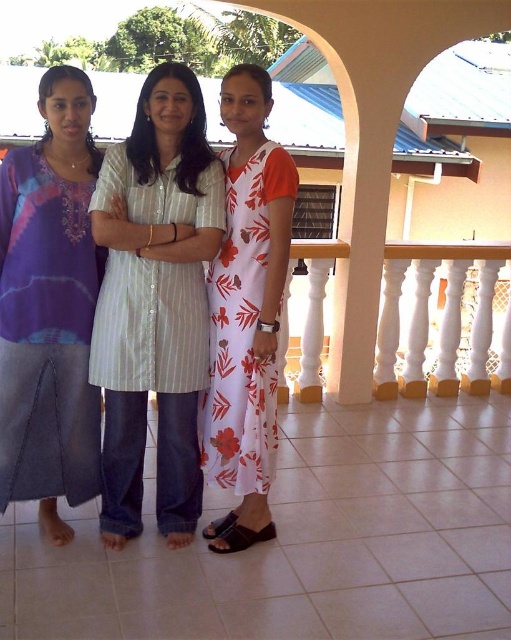
Question: Is white striped shirt at center below matte tie-dye top at left?

Choices:
 (A) no
 (B) yes

Answer: (B)

Question: Estimate the real-world distances between objects in this image. Which object is farther from the white striped shirt at center?

Choices:
 (A) white plastic balustrade at right
 (B) matte tie-dye top at left
 (C) white floral dress at center

Answer: (A)

Question: Considering the relative positions of white floral dress at center and white plastic balustrade at right in the image provided, where is white floral dress at center located with respect to white plastic balustrade at right?

Choices:
 (A) above
 (B) below

Answer: (A)

Question: Which object appears farthest from the camera in this image?

Choices:
 (A) white floral dress at center
 (B) matte tie-dye top at left

Answer: (B)

Question: Among these points, which one is nearest to the camera?

Choices:
 (A) (177, 516)
 (B) (5, 298)
 (C) (229, 516)

Answer: (B)

Question: Does white striped shirt at center lie in front of white plastic balustrade at right?

Choices:
 (A) no
 (B) yes

Answer: (B)